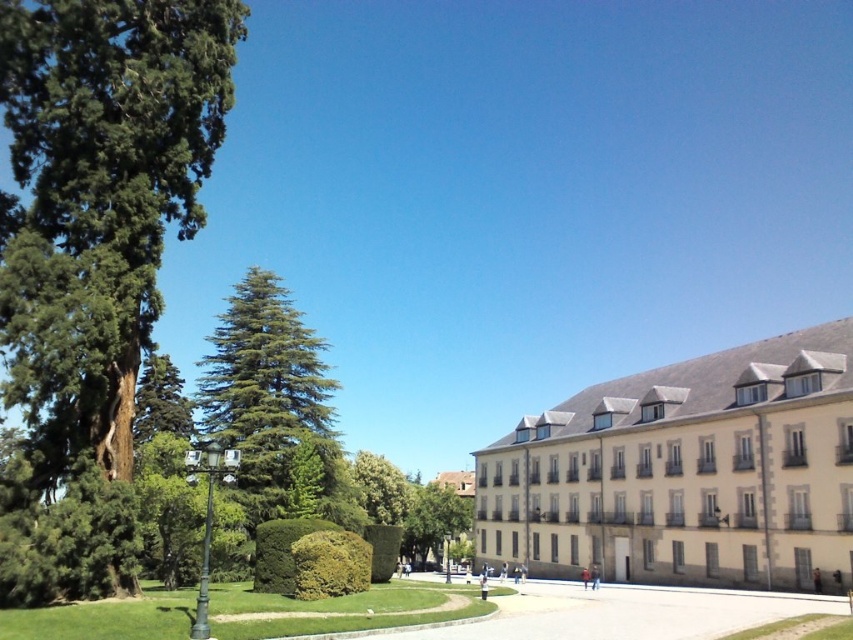
From the picture: Between green textured tree at left and beige stone building at center-right, which one has less height?

beige stone building at center-right is shorter.

Does green textured tree at left have a smaller size compared to beige stone building at center-right?

Actually, green textured tree at left might be larger than beige stone building at center-right.

This screenshot has height=640, width=853. What are the coordinates of `green textured tree at left` in the screenshot? It's located at (94, 259).

Which is in front, point (53, 248) or point (349, 566)?

Positioned in front is point (53, 248).

Which of these two, green textured tree at left or green leafy hedge at center, stands taller?

With more height is green textured tree at left.

The image size is (853, 640). Describe the element at coordinates (94, 259) in the screenshot. I see `green textured tree at left` at that location.

Image resolution: width=853 pixels, height=640 pixels. I want to click on green textured tree at left, so click(x=94, y=259).

Is green needle-like tree at center bigger than green leafy tree at center?

Yes, green needle-like tree at center is bigger than green leafy tree at center.

Image resolution: width=853 pixels, height=640 pixels. I want to click on green needle-like tree at center, so click(x=265, y=390).